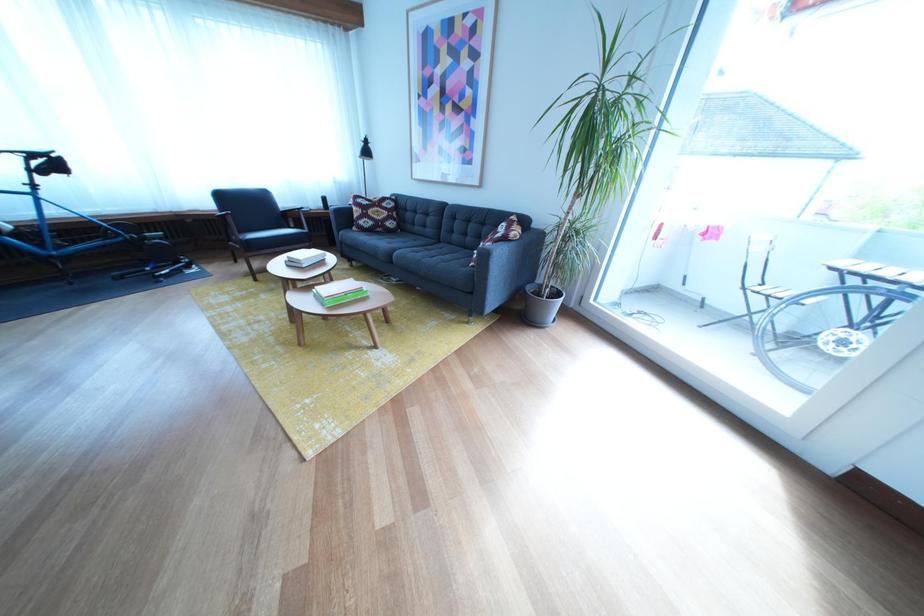
Image resolution: width=924 pixels, height=616 pixels. I want to click on bicycle wheel, so click(827, 326).